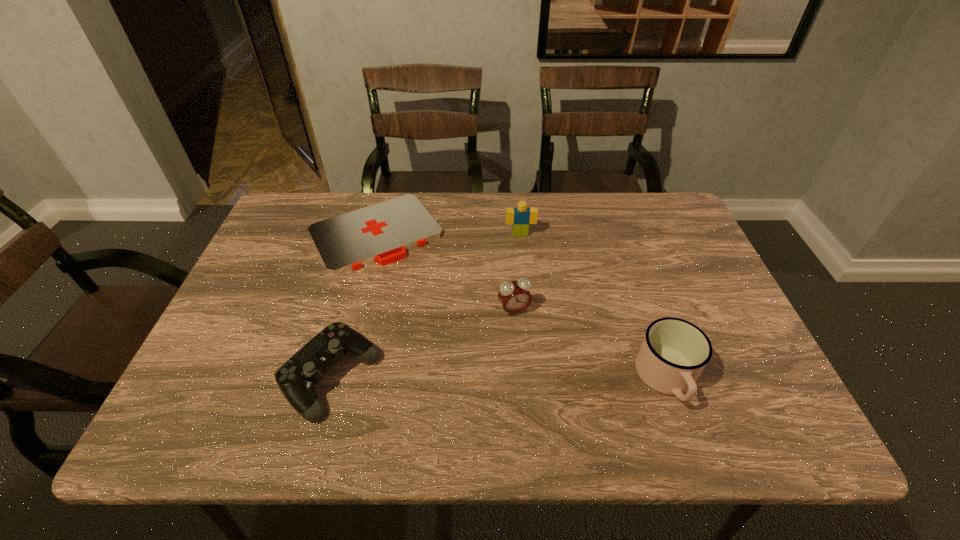
At what (x,y) coordinates should I click in order to perform the action: click on control. Please return your answer as a coordinate pair (x, y). Looking at the image, I should click on (297, 377).

Where is `mug`? mug is located at coordinates (674, 352).

I want to click on the shortest object, so click(381, 233).

Where is `Lego`? The height and width of the screenshot is (540, 960). Lego is located at coordinates (520, 217).

This screenshot has height=540, width=960. What are the coordinates of `alarm clock` in the screenshot? It's located at (514, 296).

What are the coordinates of `free spot located on the left of the control` in the screenshot? It's located at (249, 380).

Locate an element on the screen. Image resolution: width=960 pixels, height=540 pixels. vacant space located 0.360m on handle side the first-aid kit is located at coordinates (468, 369).

Where is `blank space located on handle side the first-aid kit`? Image resolution: width=960 pixels, height=540 pixels. blank space located on handle side the first-aid kit is located at coordinates (414, 286).

Locate an element on the screen. The width and height of the screenshot is (960, 540). vacant space located 0.120m on handle side the first-aid kit is located at coordinates (422, 298).

Identify the location of vacant space located on the face of the Lego. (529, 287).